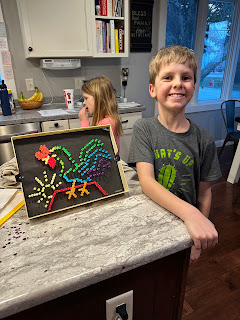
I want to click on light switch toggle, so click(78, 84), click(30, 85).